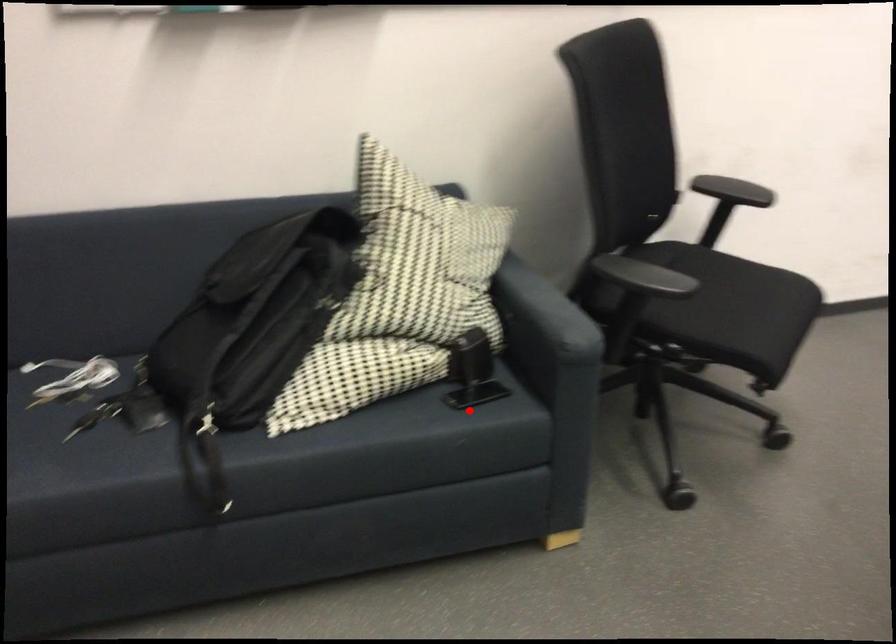
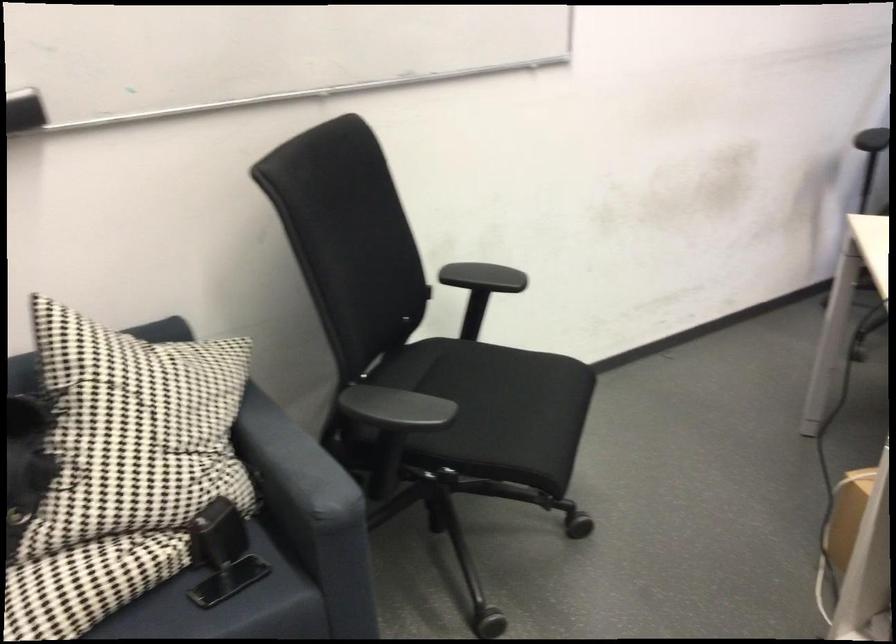
Question: I am providing you with two images of the same scene from different viewpoints. Image1 has a red point marked. In image2, the corresponding 3D location appears at what relative position? Reply with the corresponding letter.

Choices:
 (A) Closer
 (B) Farther

Answer: (A)